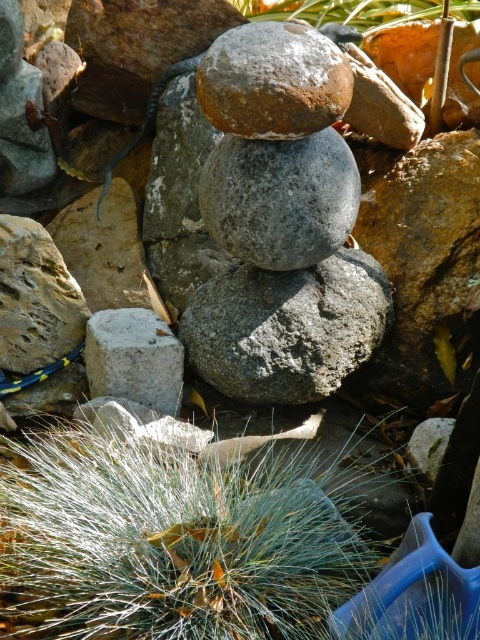
Question: Which of these objects is positioned closest to the green leafy plant at upper center?

Choices:
 (A) green grass at lower center
 (B) sandy brown rock at center

Answer: (B)

Question: Which is farther from the gray rough rock at center?

Choices:
 (A) green leafy plant at upper center
 (B) gray rough concrete block at lower left

Answer: (A)

Question: Does green grass at lower center have a smaller size compared to gray rough rock at center?

Choices:
 (A) yes
 (B) no

Answer: (B)

Question: Is green grass at lower center bigger than gray rough rock at center?

Choices:
 (A) no
 (B) yes

Answer: (B)

Question: Does green grass at lower center have a smaller size compared to gray rough concrete block at lower left?

Choices:
 (A) no
 (B) yes

Answer: (A)

Question: Which point is farther to the camera?

Choices:
 (A) green grass at lower center
 (B) sandy brown rock at center

Answer: (B)